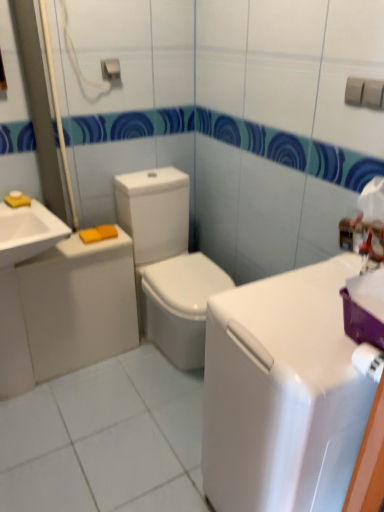
Question: Does white glossy toilet at center appear on the right side of white glossy counter top at center?

Choices:
 (A) no
 (B) yes

Answer: (A)

Question: From a real-world perspective, is white glossy toilet at center physically below white glossy counter top at center?

Choices:
 (A) no
 (B) yes

Answer: (B)

Question: From a real-world perspective, is white glossy toilet at center located higher than white glossy counter top at center?

Choices:
 (A) no
 (B) yes

Answer: (A)

Question: Does white glossy toilet at center have a larger size compared to white glossy counter top at center?

Choices:
 (A) yes
 (B) no

Answer: (A)

Question: From the image's perspective, is white glossy toilet at center on top of white glossy counter top at center?

Choices:
 (A) no
 (B) yes

Answer: (B)

Question: Can you confirm if white glossy toilet at center is wider than white glossy counter top at center?

Choices:
 (A) yes
 (B) no

Answer: (A)

Question: Considering the relative sizes of white glossy toilet at left and white glossy counter top at center in the image provided, is white glossy toilet at left wider than white glossy counter top at center?

Choices:
 (A) no
 (B) yes

Answer: (A)

Question: Can you see white glossy toilet at left touching white glossy counter top at center?

Choices:
 (A) no
 (B) yes

Answer: (A)

Question: Is white glossy toilet at left facing away from white glossy counter top at center?

Choices:
 (A) yes
 (B) no

Answer: (B)

Question: Can white glossy counter top at center be found inside white glossy toilet at left?

Choices:
 (A) no
 (B) yes

Answer: (A)

Question: Does white glossy toilet at left have a larger size compared to white glossy counter top at center?

Choices:
 (A) no
 (B) yes

Answer: (A)

Question: From the image's perspective, is white glossy toilet at left over white glossy counter top at center?

Choices:
 (A) yes
 (B) no

Answer: (A)

Question: Is metallic silver towel bar at upper center far away from white glossy counter top at center?

Choices:
 (A) no
 (B) yes

Answer: (B)